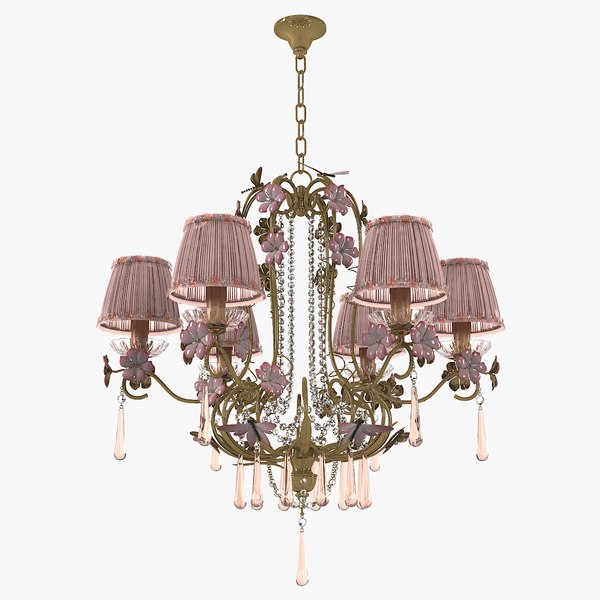
You are a GUI agent. You are given a task and a screenshot of the screen. Output one action in this format:
    pyautogui.click(x=<x>, y=<y>)
    Task: Click on the front of lamp shade
    
    Given the screenshot: What is the action you would take?
    pyautogui.click(x=143, y=286), pyautogui.click(x=218, y=252), pyautogui.click(x=365, y=256), pyautogui.click(x=360, y=317), pyautogui.click(x=469, y=294)